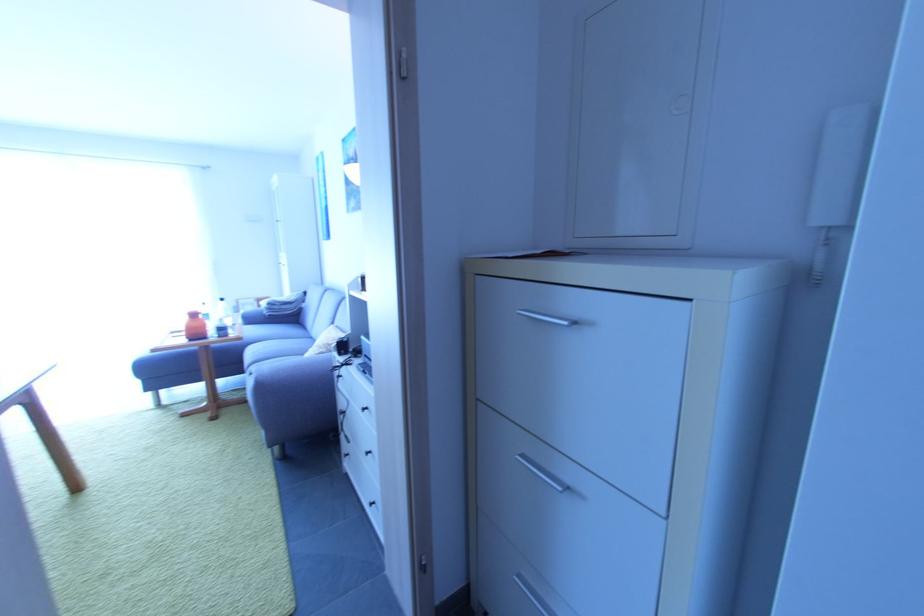
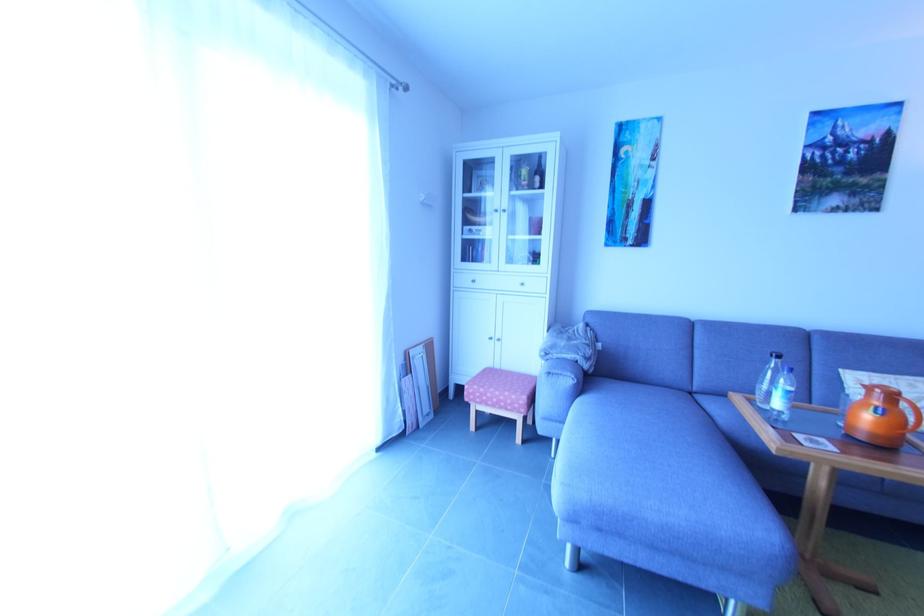
Locate, in the second image, the point that corresponds to pixel 238 306 in the first image.

(406, 362)